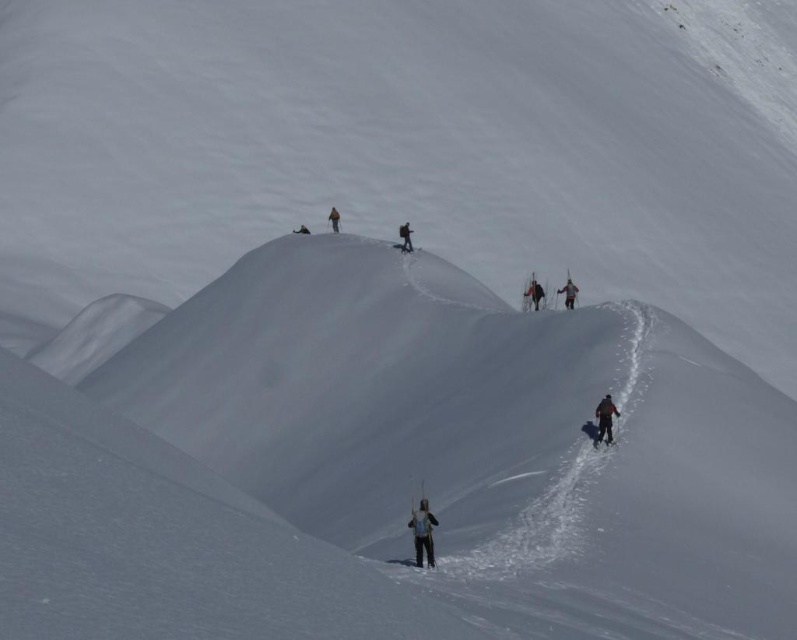
Question: Can you confirm if black matte skier at center is wider than orange fabric jacket at upper center?

Choices:
 (A) yes
 (B) no

Answer: (B)

Question: Which of the following is the closest to the observer?

Choices:
 (A) (426, 545)
 (B) (563, 289)

Answer: (A)

Question: Among these points, which one is farthest from the camera?

Choices:
 (A) (332, 218)
 (B) (560, 292)

Answer: (A)

Question: Does black matte skier at center appear over orange fabric jacket at upper center?

Choices:
 (A) no
 (B) yes

Answer: (A)

Question: Considering the relative positions of black matte skier at center and orange fabric jacket at upper center in the image provided, where is black matte skier at center located with respect to orange fabric jacket at upper center?

Choices:
 (A) below
 (B) above

Answer: (A)

Question: Which point is closer to the camera taking this photo?

Choices:
 (A) (609, 426)
 (B) (409, 230)

Answer: (A)